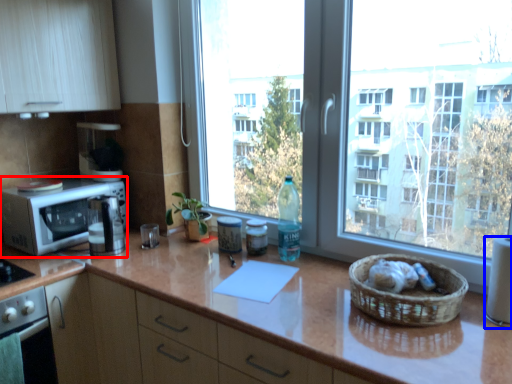
Question: Among these objects, which one is nearest to the camera, microwave oven (highlighted by a red box) or appliance (highlighted by a blue box)?

Choices:
 (A) microwave oven
 (B) appliance

Answer: (B)